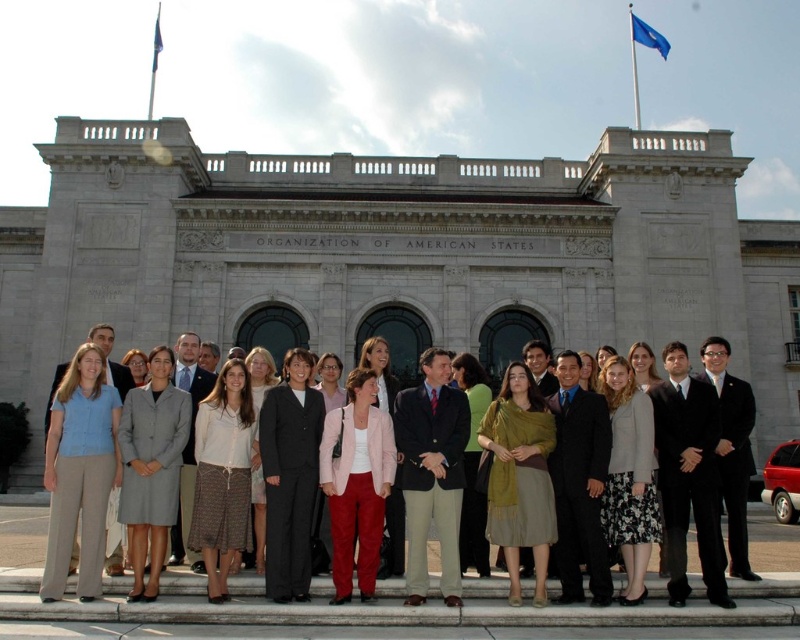
You are a photographer trying to capture a closeup of the light blue shirt at center without the white fabric flag at upper left appearing in the frame. Is this possible based on their positions?

The light blue shirt at center is below the white fabric flag at upper left, so moving the camera angle downward slightly would allow you to capture the light blue shirt at center without the white fabric flag at upper left obstructing the view.

Based on the photo, you are a photographer standing at the camera position. You want to adjust your lens to focus on the point at coordinates point (558, 509). The minimum focusing distance of your lens is 200 feet. Is the point within the focusing range?

The distance of point (558, 509) from camera is 206.05 feet, which is beyond the minimum focusing distance of 200 feet. Therefore, the point is within the focusing range as it is within the lens capability.

You are a photographer setting up for a group photo in front of the classical building. You need to ensure that the dark blue suit at center and the blue fabric flag at upper right are both visible in the frame. Based on their sizes, which object might require more careful framing to avoid being cut off?

The dark blue suit at center has a larger width than the blue fabric flag at upper right, so it might require more careful framing to avoid being cut off due to its greater size.